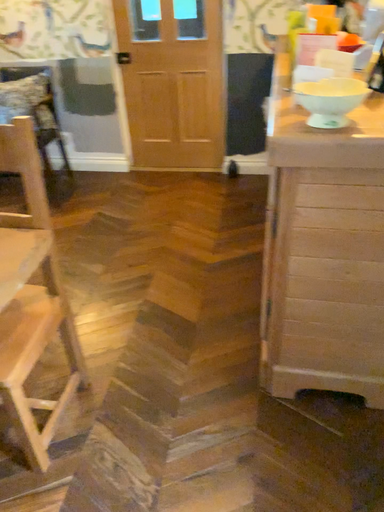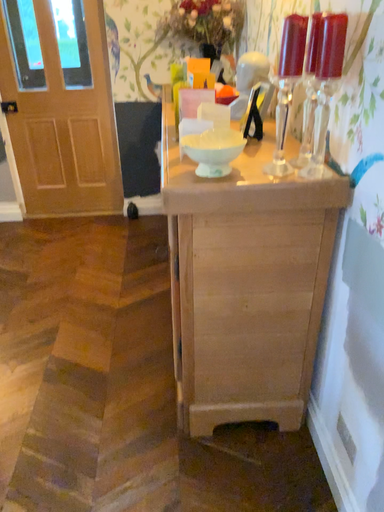
Question: Which way did the camera rotate in the video?

Choices:
 (A) rotated right
 (B) rotated left

Answer: (A)